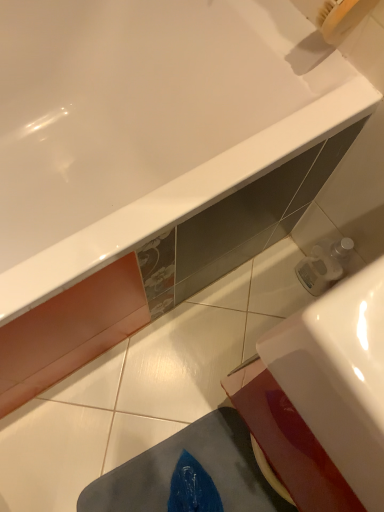
Question: Does white glossy bathtub at upper center have a lesser width compared to white glossy sink at lower right?

Choices:
 (A) no
 (B) yes

Answer: (A)

Question: Is white glossy bathtub at upper center turned away from white glossy sink at lower right?

Choices:
 (A) no
 (B) yes

Answer: (A)

Question: Is white glossy bathtub at upper center to the right of white glossy sink at lower right from the viewer's perspective?

Choices:
 (A) yes
 (B) no

Answer: (B)

Question: Considering the relative sizes of white glossy bathtub at upper center and white glossy sink at lower right in the image provided, is white glossy bathtub at upper center shorter than white glossy sink at lower right?

Choices:
 (A) no
 (B) yes

Answer: (B)

Question: Does white glossy bathtub at upper center have a greater width compared to white glossy sink at lower right?

Choices:
 (A) no
 (B) yes

Answer: (B)

Question: Is white glossy bathtub at upper center far from white glossy sink at lower right?

Choices:
 (A) yes
 (B) no

Answer: (B)

Question: Is white glossy sink at lower right wider than white glossy bathtub at upper center?

Choices:
 (A) yes
 (B) no

Answer: (B)

Question: From the image's perspective, is white glossy sink at lower right below white glossy bathtub at upper center?

Choices:
 (A) yes
 (B) no

Answer: (A)

Question: Does white glossy sink at lower right come in front of white glossy bathtub at upper center?

Choices:
 (A) yes
 (B) no

Answer: (A)

Question: Can you see white glossy sink at lower right touching white glossy bathtub at upper center?

Choices:
 (A) yes
 (B) no

Answer: (B)

Question: Is white glossy sink at lower right looking in the opposite direction of white glossy bathtub at upper center?

Choices:
 (A) no
 (B) yes

Answer: (A)

Question: Does white glossy sink at lower right lie behind white glossy bathtub at upper center?

Choices:
 (A) yes
 (B) no

Answer: (B)

Question: Is white glossy bathtub at upper center taller or shorter than white glossy sink at lower right?

Choices:
 (A) tall
 (B) short

Answer: (B)